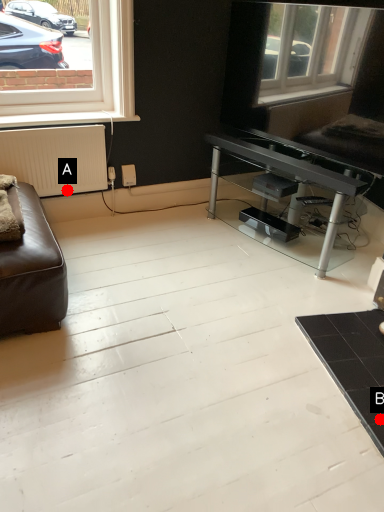
Question: Two points are circled on the image, labeled by A and B beside each circle. Among these points, which one is farthest from the camera?

Choices:
 (A) A is further
 (B) B is further

Answer: (A)